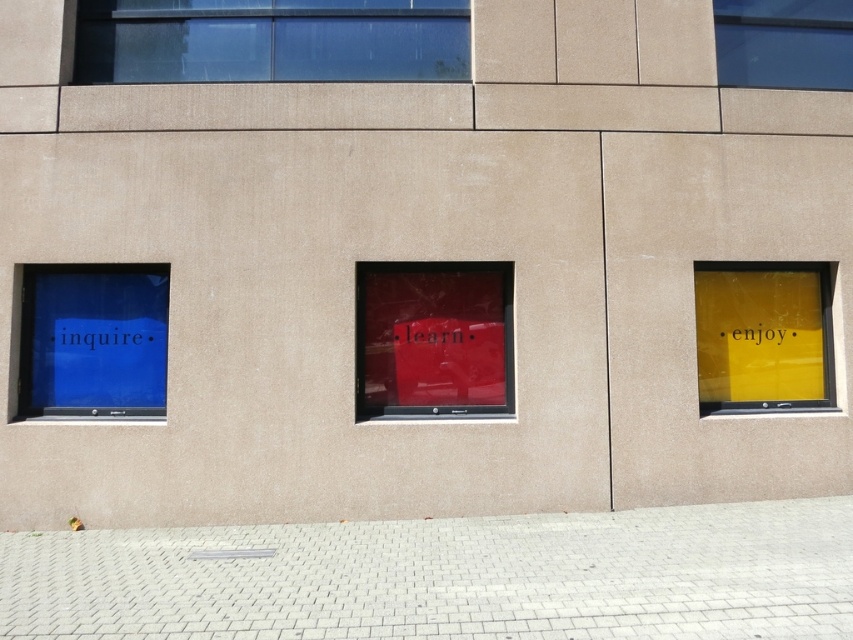
Is blue matte sign at left positioned before yellow matte sign at right?

That is True.

Which is in front, point (38, 340) or point (799, 337)?

Point (38, 340) is more forward.

Locate an element on the screen. This screenshot has height=640, width=853. blue matte sign at left is located at coordinates (91, 340).

Does transparent glass window at upper center appear under transparent glass window at upper right?

Indeed, transparent glass window at upper center is positioned under transparent glass window at upper right.

Is point (177, 45) less distant than point (766, 3)?

Yes, it is.

Who is more distant from viewer, (310, 60) or (743, 49)?

The point (743, 49) is more distant.

The width and height of the screenshot is (853, 640). I want to click on transparent glass window at upper center, so [x=270, y=38].

The height and width of the screenshot is (640, 853). What do you see at coordinates (270, 38) in the screenshot? I see `transparent glass window at upper center` at bounding box center [270, 38].

Can you confirm if transparent glass window at upper center is positioned below yellow matte sign at right?

No.

What are the coordinates of `transparent glass window at upper center` in the screenshot? It's located at (270, 38).